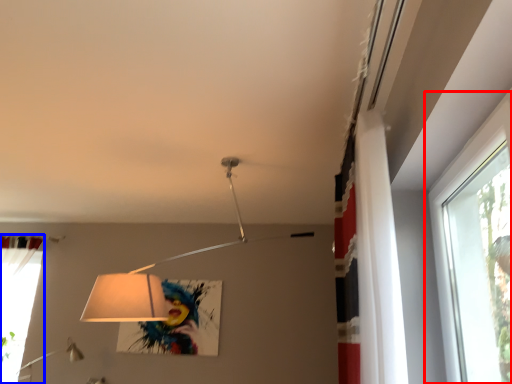
Question: Which point is closer to the camera, window (highlighted by a red box) or curtain (highlighted by a blue box)?

Choices:
 (A) window
 (B) curtain

Answer: (A)